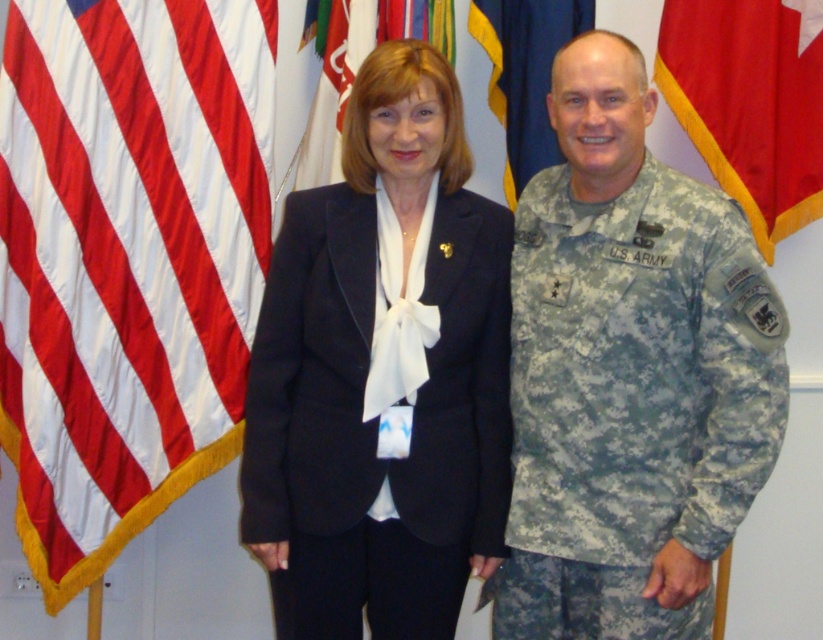
Question: Is camouflage fabric us army uniform at right thinner than red fabric flag at right?

Choices:
 (A) yes
 (B) no

Answer: (B)

Question: Among these points, which one is nearest to the camera?

Choices:
 (A) (496, 74)
 (B) (26, 161)
 (C) (263, 314)

Answer: (C)

Question: Which object is the closest to the matte black suit at center?

Choices:
 (A) black matte suit at center
 (B) blue fabric flag at upper center

Answer: (A)

Question: Is matte black suit at center smaller than black matte suit at center?

Choices:
 (A) yes
 (B) no

Answer: (B)

Question: Which of the following is the closest to the observer?

Choices:
 (A) camouflage fabric us army uniform at right
 (B) white fabric flag at upper center
 (C) silky satin flag at left

Answer: (A)

Question: Is black matte suit at center bigger than blue fabric flag at upper center?

Choices:
 (A) no
 (B) yes

Answer: (B)